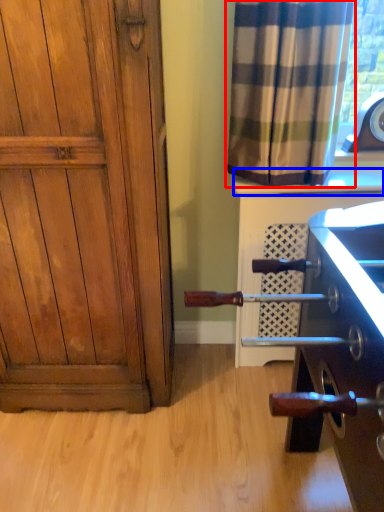
Question: Which point is closer to the camera, curtain (highlighted by a red box) or window sill (highlighted by a blue box)?

Choices:
 (A) curtain
 (B) window sill

Answer: (A)